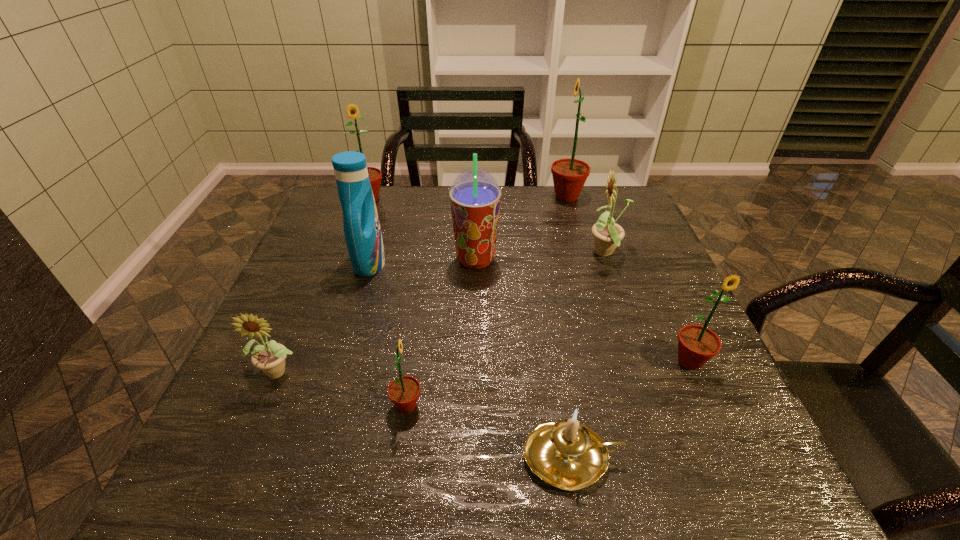
Where is `unoccupied area between the nearest object and the second smallest green sunflower`? Image resolution: width=960 pixels, height=540 pixels. unoccupied area between the nearest object and the second smallest green sunflower is located at coordinates pyautogui.click(x=631, y=409).

Find the location of a particular element. This screenshot has height=540, width=960. free spot between the second nearest green sunflower and the bigger yellow sunflower is located at coordinates click(x=648, y=308).

Locate an element on the screen. Image resolution: width=960 pixels, height=540 pixels. free point between the leftmost green sunflower and the smoothie is located at coordinates (422, 229).

You are a GUI agent. You are given a task and a screenshot of the screen. Output one action in this format:
    pyautogui.click(x=<x>, y=<y>)
    Task: Click on the vacant area that lies between the smaller yellow sunflower and the eighth farthest object
    The width and height of the screenshot is (960, 540).
    Given the screenshot: What is the action you would take?
    pyautogui.click(x=344, y=388)

The image size is (960, 540). Find the location of `object that is the eighth closest to the fifth object from left to right`. object that is the eighth closest to the fifth object from left to right is located at coordinates (568, 455).

Image resolution: width=960 pixels, height=540 pixels. I want to click on object that stands as the eighth closest to the detergent, so click(697, 344).

Image resolution: width=960 pixels, height=540 pixels. I want to click on sunflower identified as the third closest to the third smallest green sunflower, so click(x=608, y=234).

You are a GUI agent. You are given a task and a screenshot of the screen. Output one action in this format:
    pyautogui.click(x=<x>, y=<y>)
    Task: Click on the sunflower that stands as the closest to the tallest object
    This screenshot has width=960, height=540.
    Given the screenshot: What is the action you would take?
    pyautogui.click(x=608, y=234)

Find the location of `green sunflower that stands as the third closest to the leftmost green sunflower`. green sunflower that stands as the third closest to the leftmost green sunflower is located at coordinates (697, 344).

The height and width of the screenshot is (540, 960). Identify the location of green sunflower that is the third closest one to the sixth object from right to left. (569, 175).